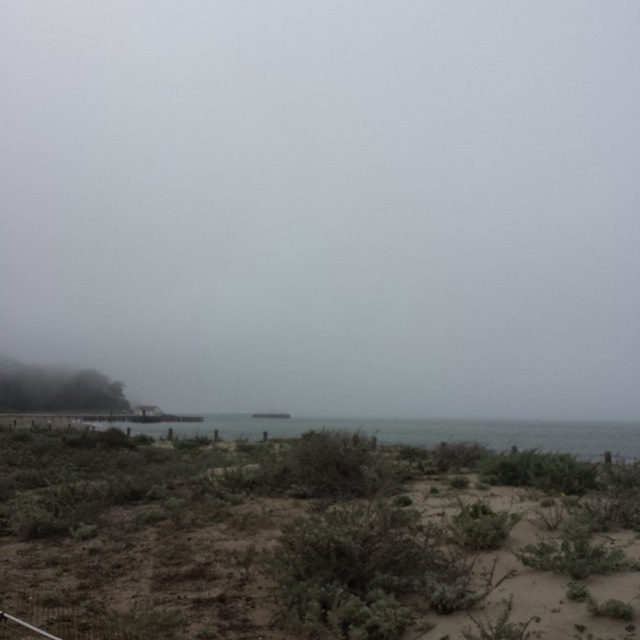
Does brown sandy soil at lower center have a lesser width compared to clear water at center?

Correct, brown sandy soil at lower center's width is less than clear water at center's.

Find the location of a particular element. brown sandy soil at lower center is located at coordinates (310, 540).

Find the location of a particular element. This screenshot has width=640, height=640. brown sandy soil at lower center is located at coordinates (310, 540).

Can you confirm if foggy misty sky at upper center is positioned below clear water at center?

No, foggy misty sky at upper center is not below clear water at center.

Can you confirm if foggy misty sky at upper center is smaller than clear water at center?

No, foggy misty sky at upper center is not smaller than clear water at center.

The image size is (640, 640). What do you see at coordinates (326, 202) in the screenshot?
I see `foggy misty sky at upper center` at bounding box center [326, 202].

Image resolution: width=640 pixels, height=640 pixels. Find the location of `foggy misty sky at upper center`. foggy misty sky at upper center is located at coordinates (326, 202).

Is foggy misty sky at upper center positioned in front of brown sandy soil at lower center?

No, it is not.

Between foggy misty sky at upper center and brown sandy soil at lower center, which one has more height?

With more height is foggy misty sky at upper center.

Who is more forward, (397, 362) or (396, 564)?

Point (396, 564) is in front.

This screenshot has height=640, width=640. I want to click on foggy misty sky at upper center, so click(x=326, y=202).